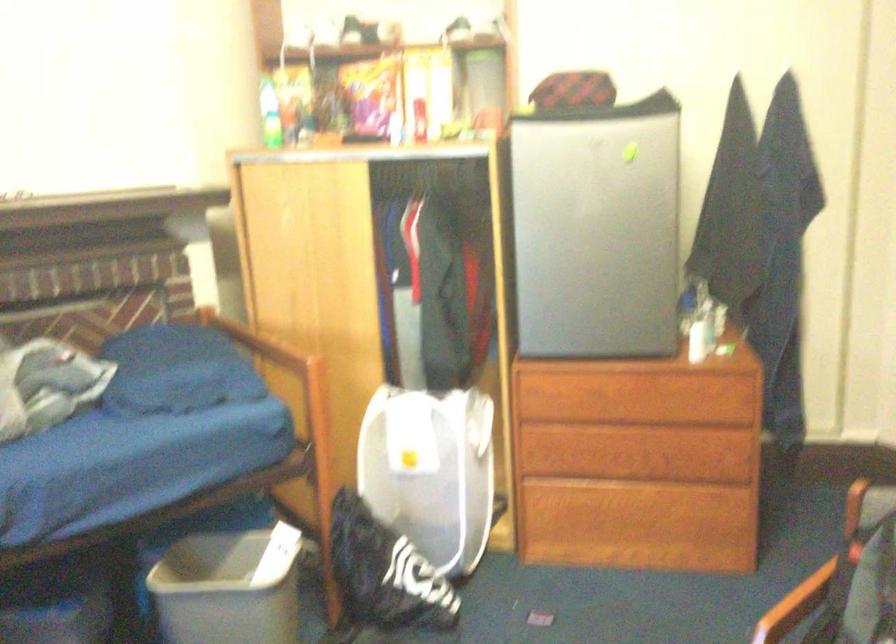
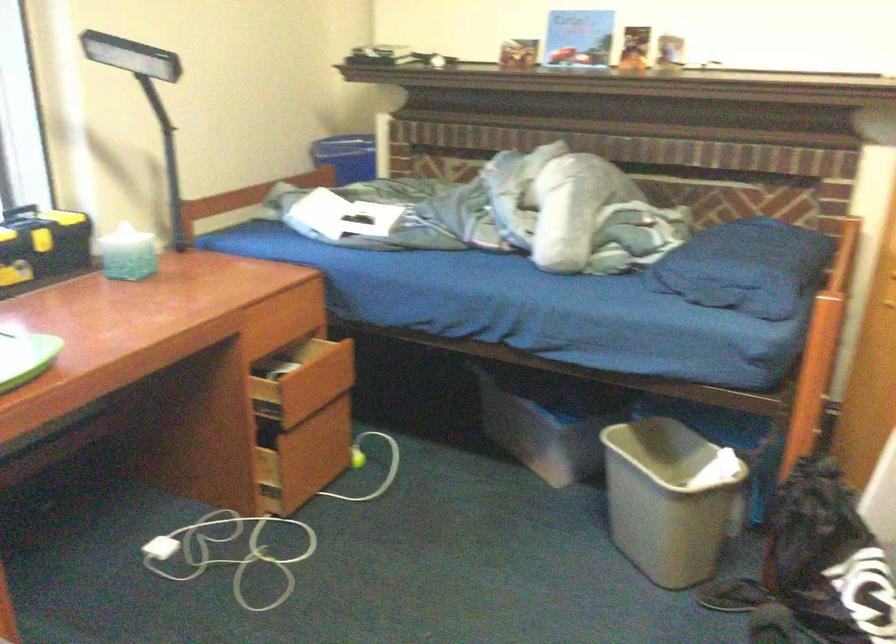
The first image is from the beginning of the video and the second image is from the end. How did the camera likely rotate when shooting the video?

The camera's rotation is toward left-down.